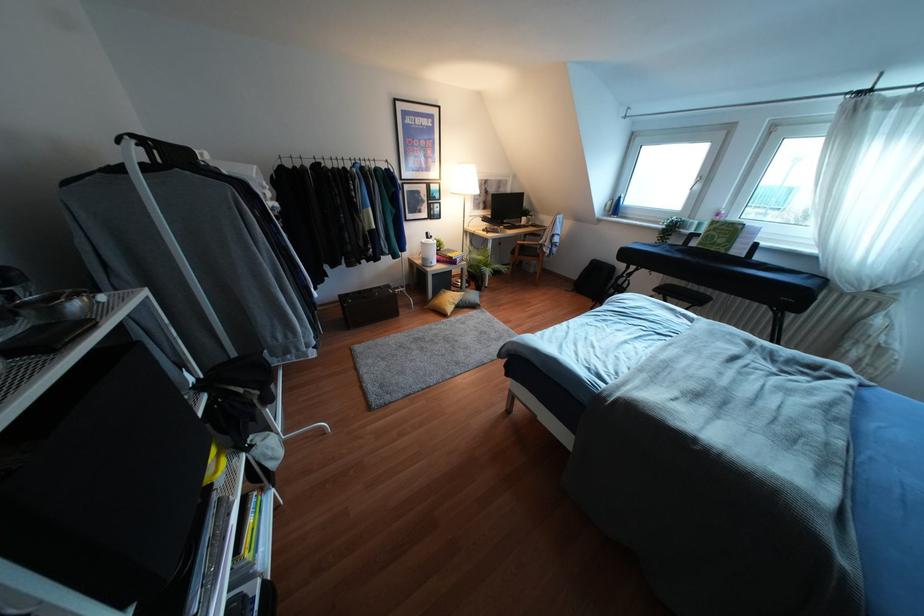
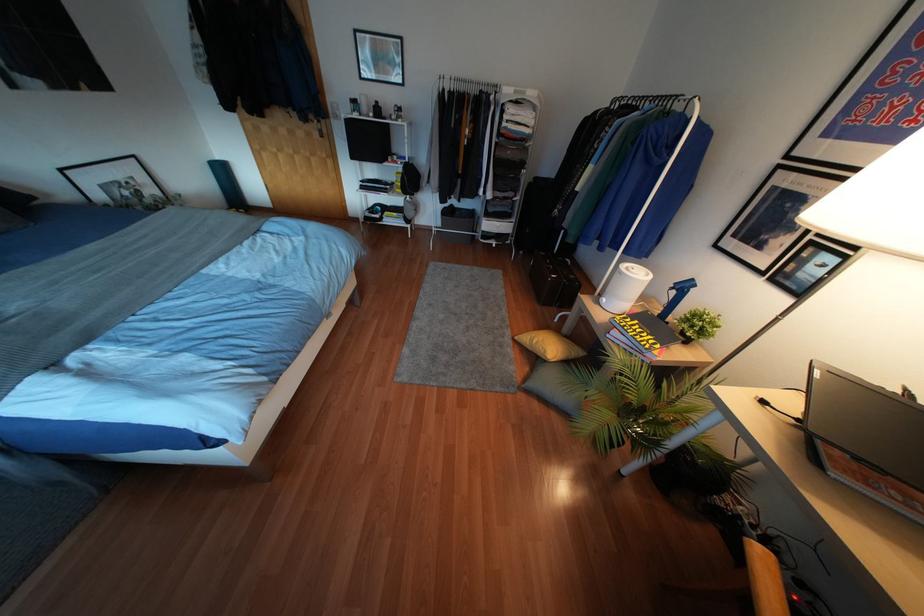
Locate, in the second image, the point that corresponds to (427,233) in the first image.

(690, 280)